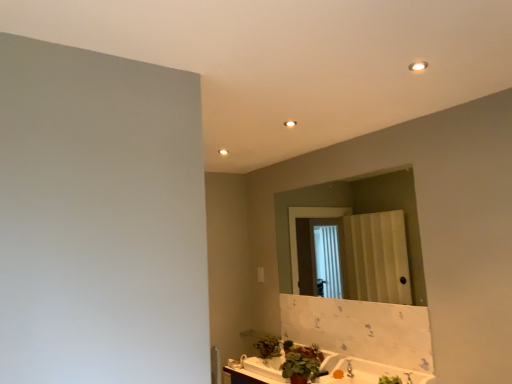
Question: Would you say green matte plant at lower center, the third plant positioned from the back, is inside or outside white glossy countertop at lower center?

Choices:
 (A) inside
 (B) outside

Answer: (B)

Question: Visually, is green matte plant at lower center, the 1th plant positioned from the front, positioned to the left or to the right of white glossy countertop at lower center?

Choices:
 (A) left
 (B) right

Answer: (A)

Question: Estimate the real-world distances between objects in this image. Which object is farther from the silver metallic faucet at lower center?

Choices:
 (A) green matte plant at lower center, the 2th plant in the front-to-back sequence
 (B) green leafy plant at lower center, the 3th plant viewed from the front
 (C) white glossy light fixture at upper right
 (D) matte glass mirror at center
 (E) green matte plant at lower center, the third plant positioned from the back

Answer: (C)

Question: Which object is positioned closest to the matte glass mirror at center?

Choices:
 (A) green matte plant at lower center, the 2th plant in the front-to-back sequence
 (B) silver metallic faucet at lower center
 (C) green matte plant at lower center, the 1th plant positioned from the front
 (D) white glossy light fixture at upper right
 (E) green leafy plant at lower center, marked as the 1th plant in a back-to-front arrangement

Answer: (C)